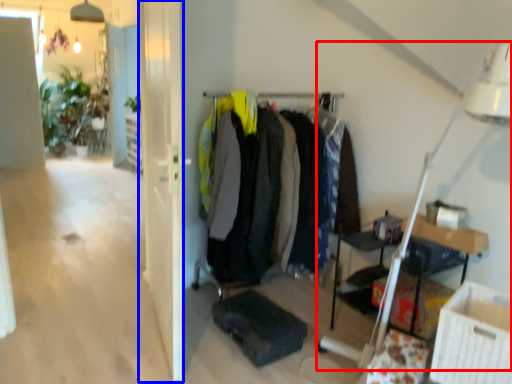
Question: Which point is further to the camera, table lamp (highlighted by a red box) or glass door (highlighted by a blue box)?

Choices:
 (A) table lamp
 (B) glass door

Answer: (B)